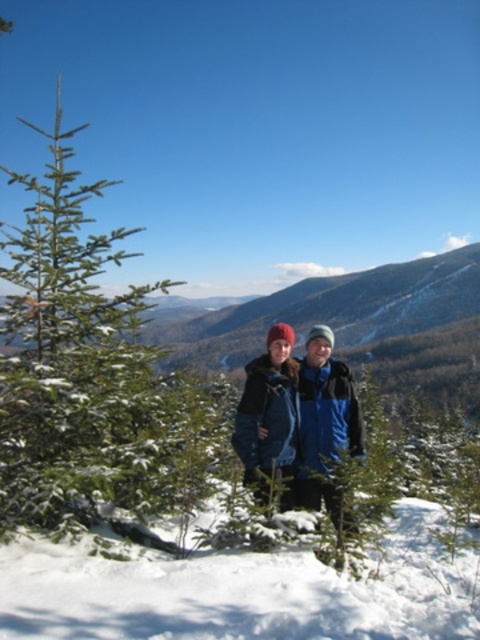
Question: Can you confirm if white snow at lower left is positioned to the right of blue woolen jacket at center?

Choices:
 (A) yes
 (B) no

Answer: (A)

Question: Which of the following is the farthest from the observer?

Choices:
 (A) (314, 348)
 (B) (20, 323)

Answer: (A)

Question: Can you confirm if green textured pine tree at left is bigger than white snow at lower left?

Choices:
 (A) yes
 (B) no

Answer: (A)

Question: Among these objects, which one is nearest to the camera?

Choices:
 (A) white snow at lower left
 (B) green textured pine tree at left
 (C) blue woolen jacket at center

Answer: (A)

Question: Does green textured pine tree at left have a smaller size compared to blue woolen jacket at center?

Choices:
 (A) yes
 (B) no

Answer: (B)

Question: Which of the following is the farthest from the observer?

Choices:
 (A) white snow at lower left
 (B) blue woolen jacket at center
 (C) green textured pine tree at left

Answer: (B)